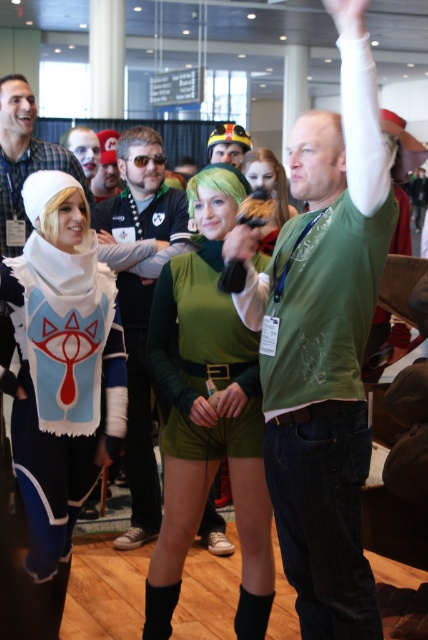
From the picture: Is white plush cape at left to the left of matte black cap at center from the viewer's perspective?

No, white plush cape at left is not to the left of matte black cap at center.

Which of these two, white plush cape at left or matte black cap at center, stands shorter?

matte black cap at center is shorter.

Identify the location of white plush cape at left. The height and width of the screenshot is (640, 428). (62, 392).

Is point (101, 141) closer to viewer compared to point (68, 131)?

No, (101, 141) is further to viewer.

Does matte black cap at center have a lesser height compared to matte black mask at center?

No.

You are a GUI agent. You are given a task and a screenshot of the screen. Output one action in this format:
    pyautogui.click(x=<x>, y=<y>)
    Task: Click on the matte black cap at center
    
    Given the screenshot: What is the action you would take?
    pyautogui.click(x=106, y=166)

Between white plush cape at left and matte white scarf at left, which one is positioned lower?

white plush cape at left is below.

What do you see at coordinates (62, 392) in the screenshot? Image resolution: width=428 pixels, height=640 pixels. I see `white plush cape at left` at bounding box center [62, 392].

Where is `white plush cape at left`? Image resolution: width=428 pixels, height=640 pixels. white plush cape at left is located at coordinates (62, 392).